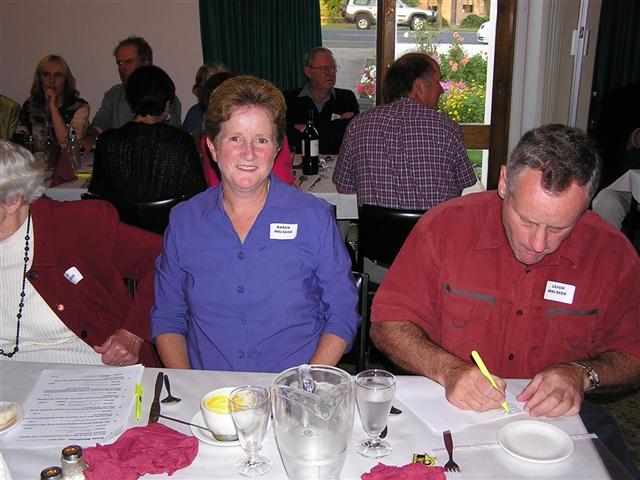
Find the location of `water glasses`. water glasses is located at coordinates (371, 415), (242, 419).